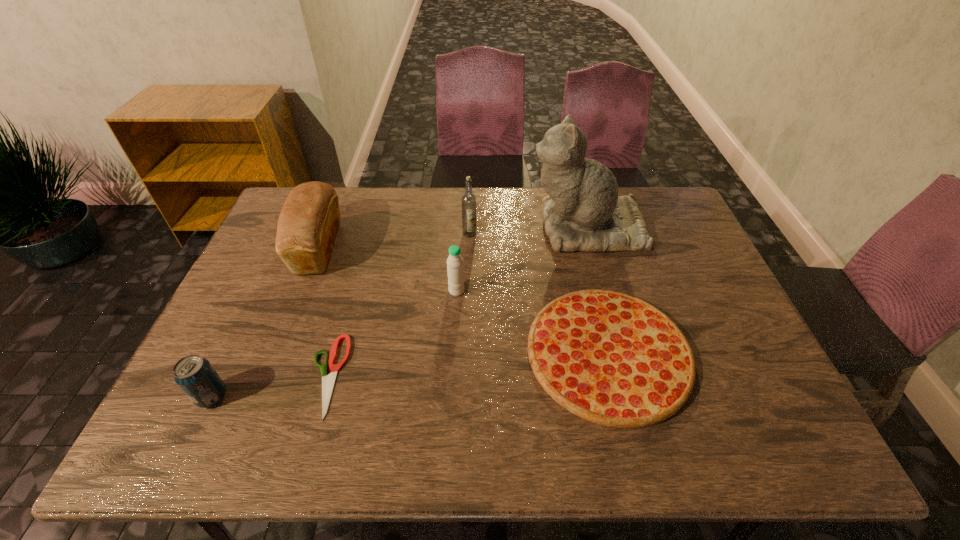
Where is `free space located on the front-facing side of the cat`? The height and width of the screenshot is (540, 960). free space located on the front-facing side of the cat is located at coordinates (454, 227).

Identify the location of vacant region located on the front-facing side of the cat. The height and width of the screenshot is (540, 960). (451, 227).

Locate an element on the screen. This screenshot has width=960, height=540. free space located on the label of the sixth shortest object is located at coordinates (469, 251).

Locate an element on the screen. vacant area located 0.220m on the right of the second object from left to right is located at coordinates (409, 247).

Locate an element on the screen. vacant space located on the back of the water bottle is located at coordinates (460, 234).

Where is `free space located 0.350m on the right of the pop soda`? free space located 0.350m on the right of the pop soda is located at coordinates (378, 396).

Where is `vacant region located on the left of the sixth tallest object`? This screenshot has width=960, height=540. vacant region located on the left of the sixth tallest object is located at coordinates (488, 353).

Where is `free space located on the back of the fifth object from right to left`? free space located on the back of the fifth object from right to left is located at coordinates (359, 263).

This screenshot has width=960, height=540. I want to click on cat that is at the far edge, so click(583, 212).

At what (x,y) coordinates should I click in order to perform the action: click on bread present at the far edge. Please return your answer as a coordinate pair (x, y). Image resolution: width=960 pixels, height=540 pixels. Looking at the image, I should click on (309, 220).